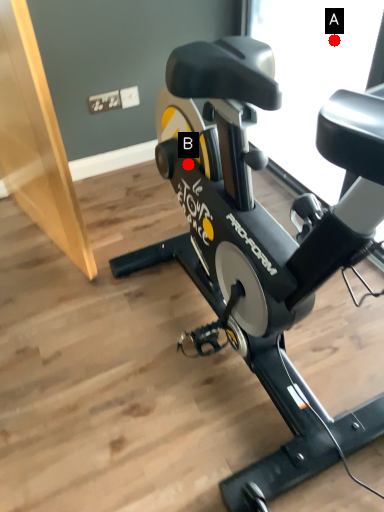
Question: Two points are circled on the image, labeled by A and B beside each circle. Which of the following is the farthest from the observer?

Choices:
 (A) A is further
 (B) B is further

Answer: (A)